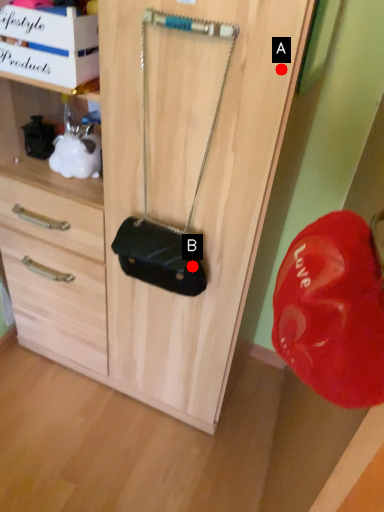
Question: Two points are circled on the image, labeled by A and B beside each circle. Which point appears closest to the camera in this image?

Choices:
 (A) A is closer
 (B) B is closer

Answer: (A)